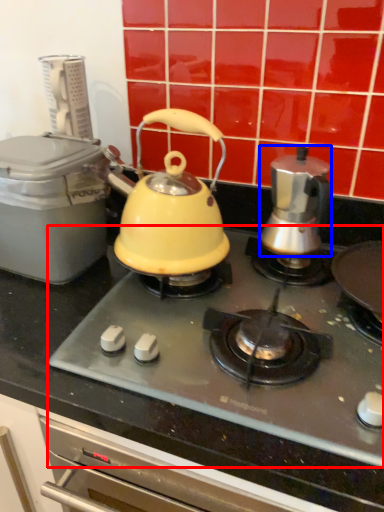
Question: Which of the following is the farthest to the observer, gas stove (highlighted by a red box) or kettle (highlighted by a blue box)?

Choices:
 (A) gas stove
 (B) kettle

Answer: (B)